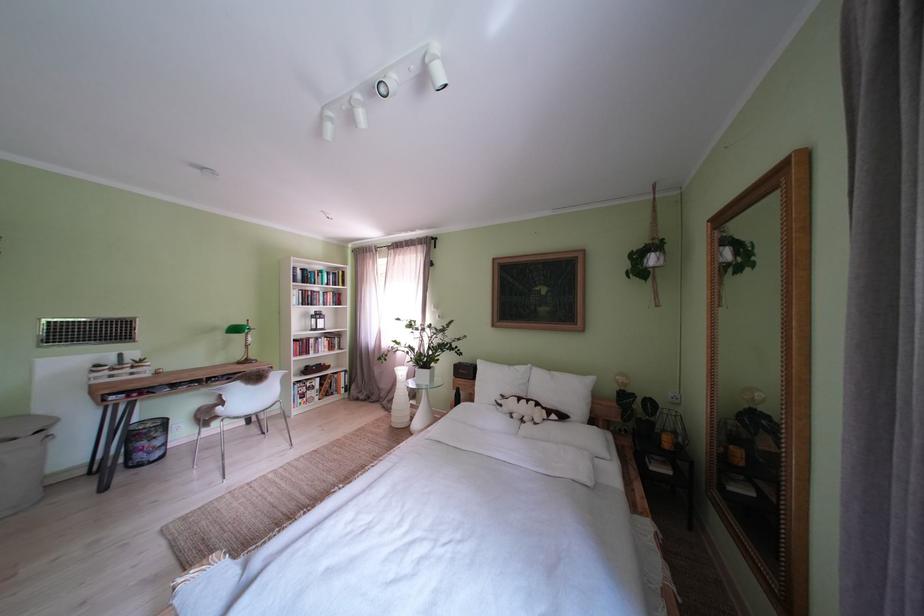
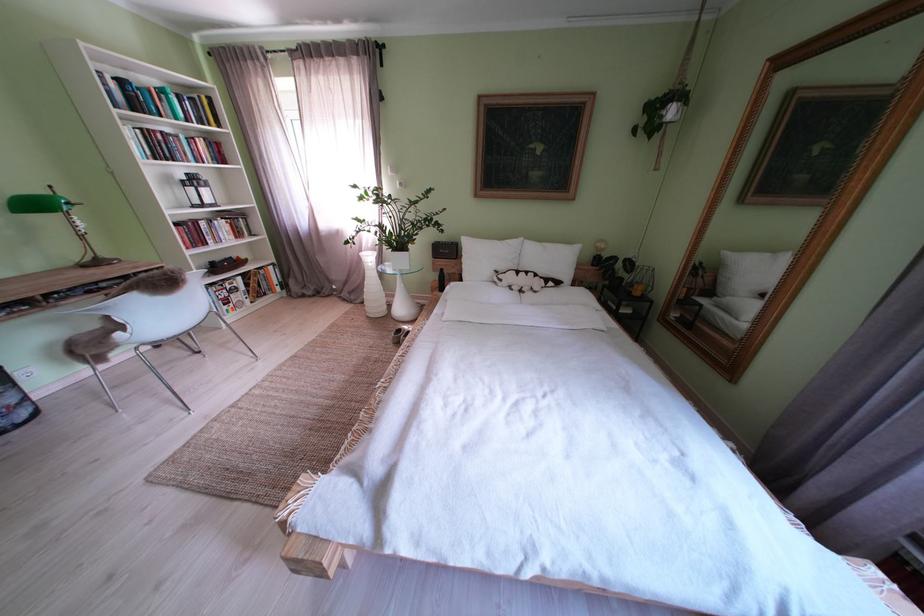
Locate, in the second image, the point that corresponds to (x=678, y=451) in the first image.

(648, 299)